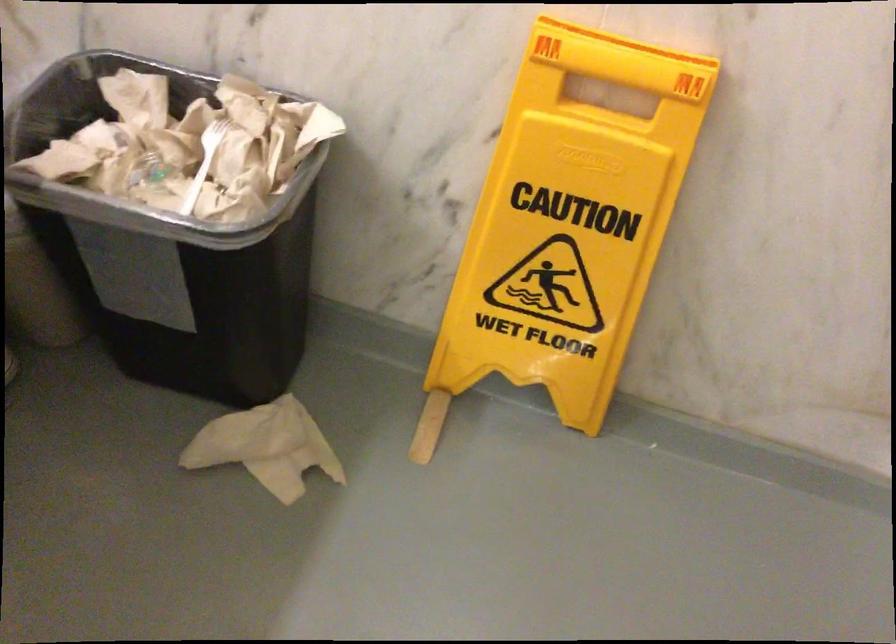
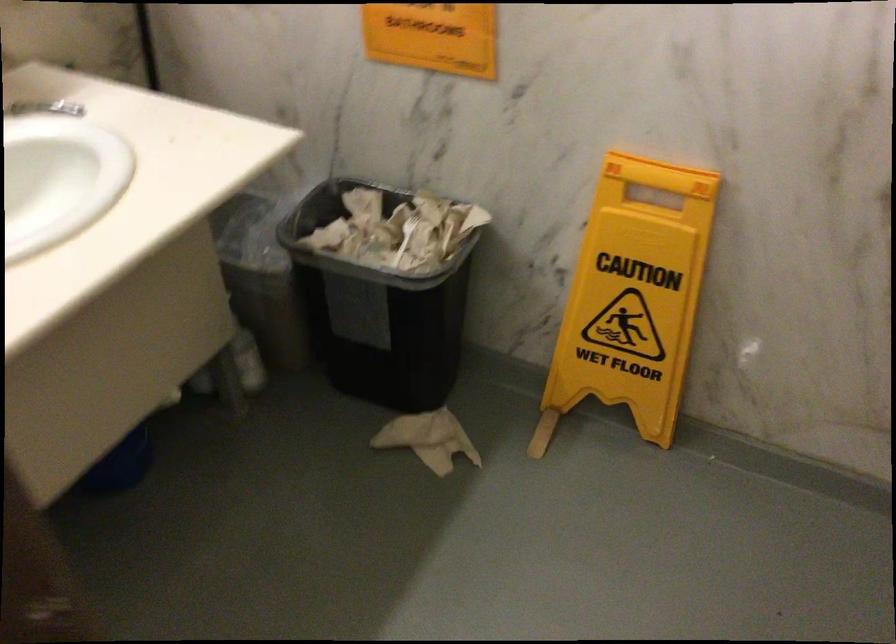
Question: The images are taken continuously from a first-person perspective. In which direction is your viewpoint rotating?

Choices:
 (A) Left
 (B) Right
 (C) Up
 (D) Down

Answer: (C)